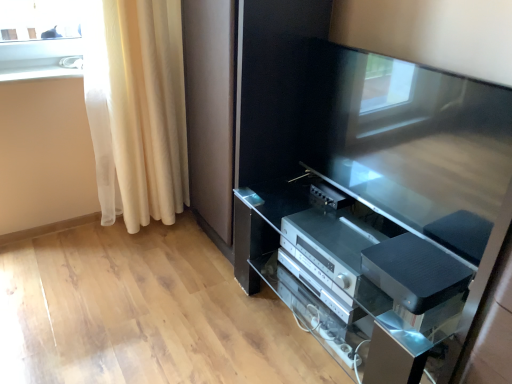
Locate an element on the screen. This screenshot has width=512, height=384. free space to the left of satin black tv cabinet at center is located at coordinates (173, 314).